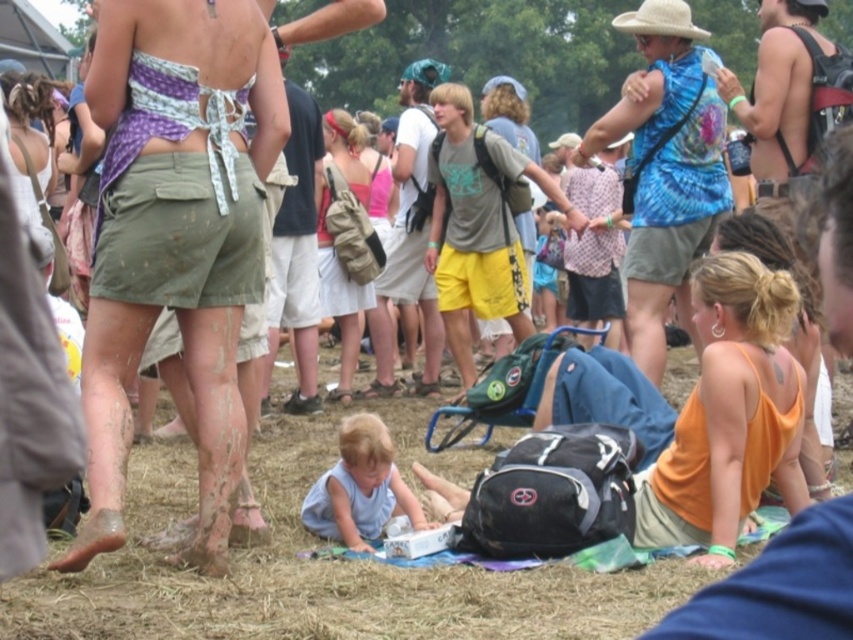
You are organizing a clothing donation drive and need to categorize the orange matte tank top at lower right and the matte pink tank top at center based on their sizes. Which tank top should be placed in the small size section?

The orange matte tank top at lower right should be placed in the small size section because it has a smaller size compared to the matte pink tank top at center.

You are standing in the festival area and see both the orange matte tank top at lower right and the light blue fabric at lower center. Which one is closer to you?

The orange matte tank top at lower right is closer to you because it is in front of the light blue fabric at lower center.